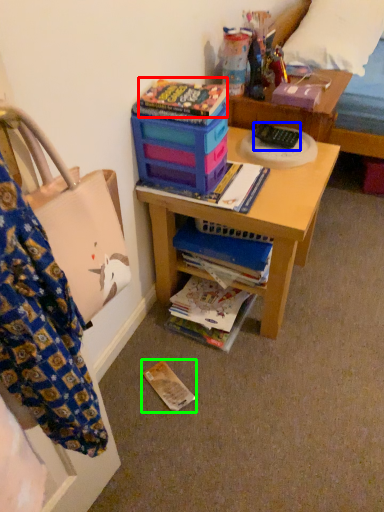
Question: Estimate the real-world distances between objects in this image. Which object is closer to paperback book (highlighted by a red box), remote control (highlighted by a blue box) or paperback book (highlighted by a green box)?

Choices:
 (A) remote control
 (B) paperback book

Answer: (A)